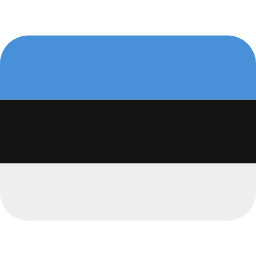
The width and height of the screenshot is (256, 256). I want to click on curved corners, so click(x=248, y=211), click(x=13, y=214), click(x=17, y=37), click(x=246, y=43).